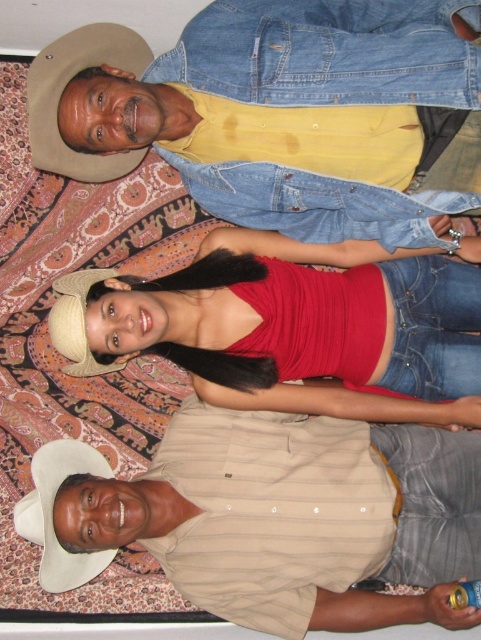
You are a photographer taking a photo of the tan striped shirt at lower center and the matte red tank top at center. Which object will appear larger in the photo?

The tan striped shirt at lower center appears larger in the photo because it is closer to the viewer than the matte red tank top at center.